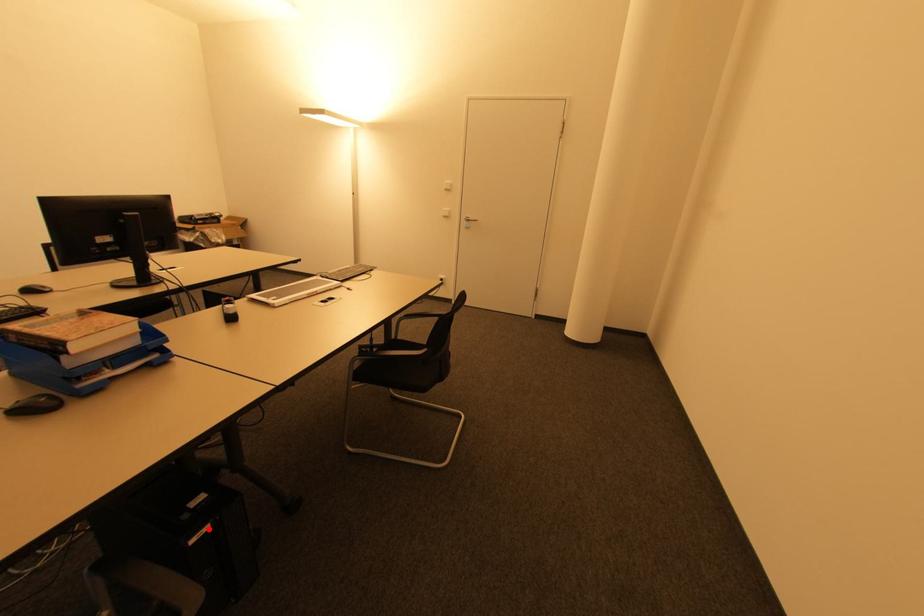
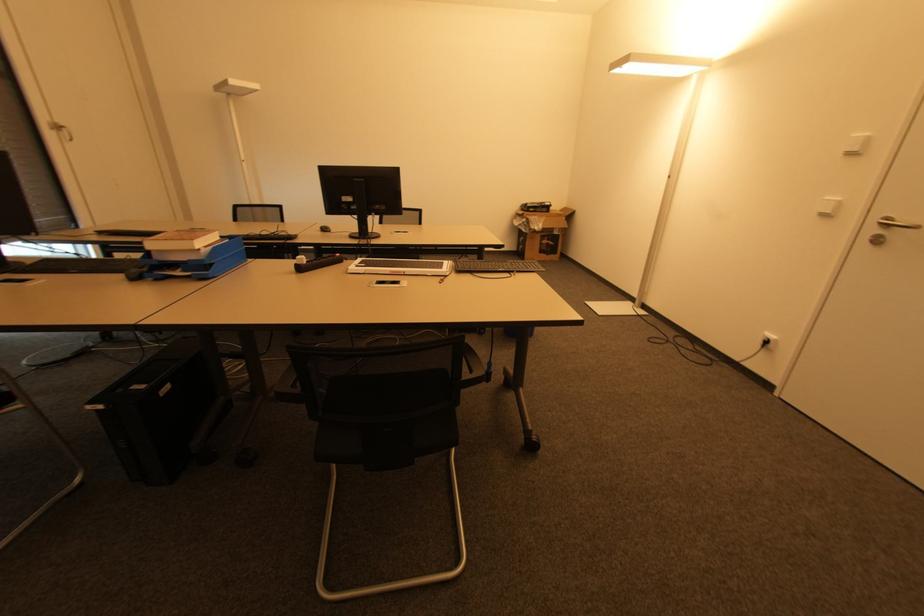
Locate, in the second image, the point that corresponds to the highlighted location in the first image.

(101, 408)